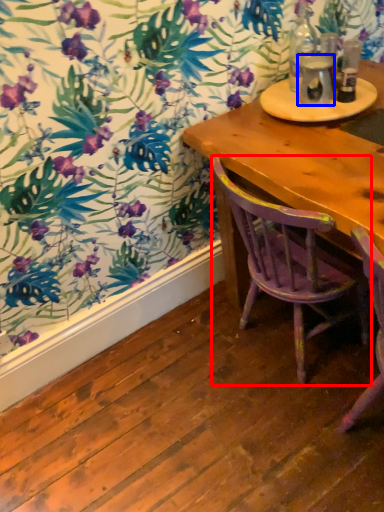
Question: Which point is closer to the camera, chair (highlighted by a red box) or beverage (highlighted by a blue box)?

Choices:
 (A) chair
 (B) beverage

Answer: (A)